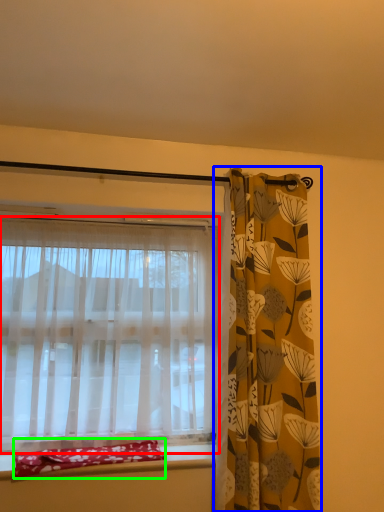
Question: Which object is the farthest from curtain (highlighted by a red box)? Choose among these: curtain (highlighted by a blue box) or material (highlighted by a green box).

Choices:
 (A) curtain
 (B) material

Answer: (A)